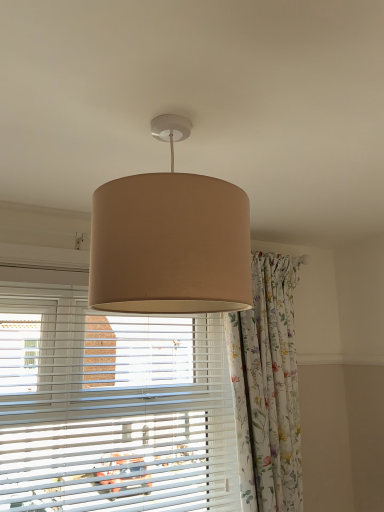
Question: From a real-world perspective, is floral fabric curtain at center positioned above or below beige fabric lampshade at center?

Choices:
 (A) above
 (B) below

Answer: (B)

Question: Is floral fabric curtain at center bigger or smaller than beige fabric lampshade at center?

Choices:
 (A) big
 (B) small

Answer: (A)

Question: Considering the real-world distances, which object is farthest from the white plastic blinds at center?

Choices:
 (A) beige fabric lampshade at center
 (B) floral fabric curtain at center

Answer: (A)

Question: Based on their relative distances, which object is farther from the floral fabric curtain at center?

Choices:
 (A) beige fabric lampshade at center
 (B) white plastic blinds at center

Answer: (A)